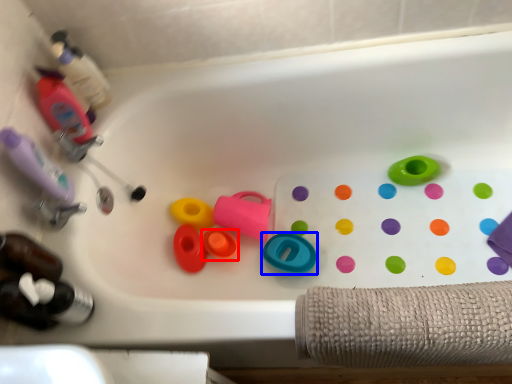
Question: Which object appears closest to the camera in this image, toy (highlighted by a red box) or toy (highlighted by a blue box)?

Choices:
 (A) toy
 (B) toy

Answer: (B)